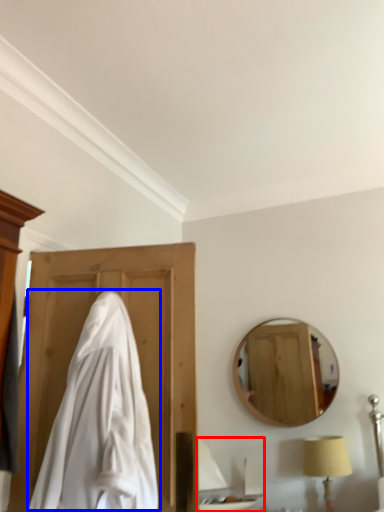
Question: Among these objects, which one is nearest to the camera, sink (highlighted by a red box) or cloak (highlighted by a blue box)?

Choices:
 (A) sink
 (B) cloak

Answer: (B)